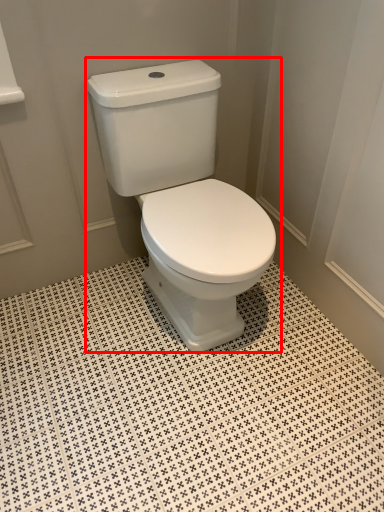
Question: Considering the relative positions of toilet (annotated by the red box) and ceramic tile in the image provided, where is toilet (annotated by the red box) located with respect to the staircase?

Choices:
 (A) left
 (B) right

Answer: (B)